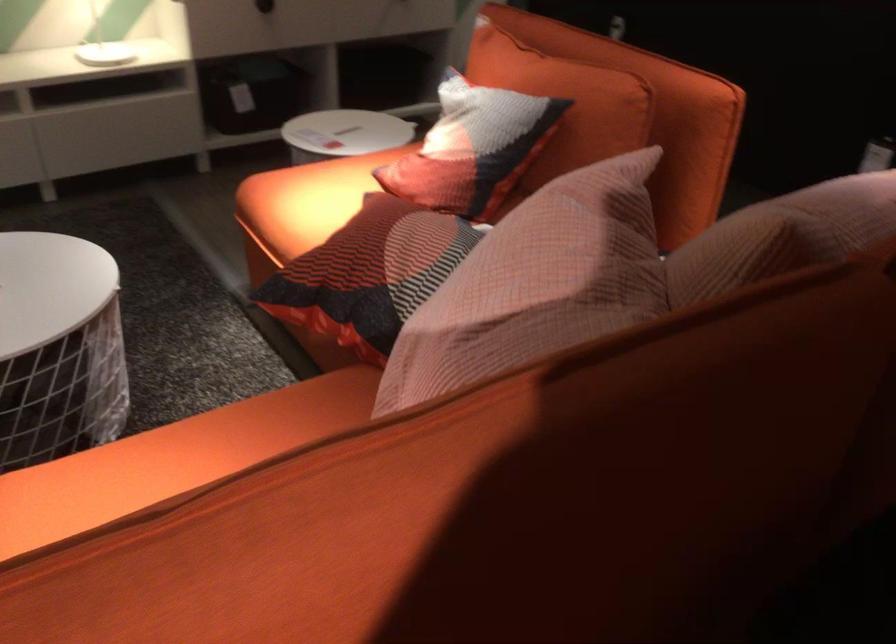
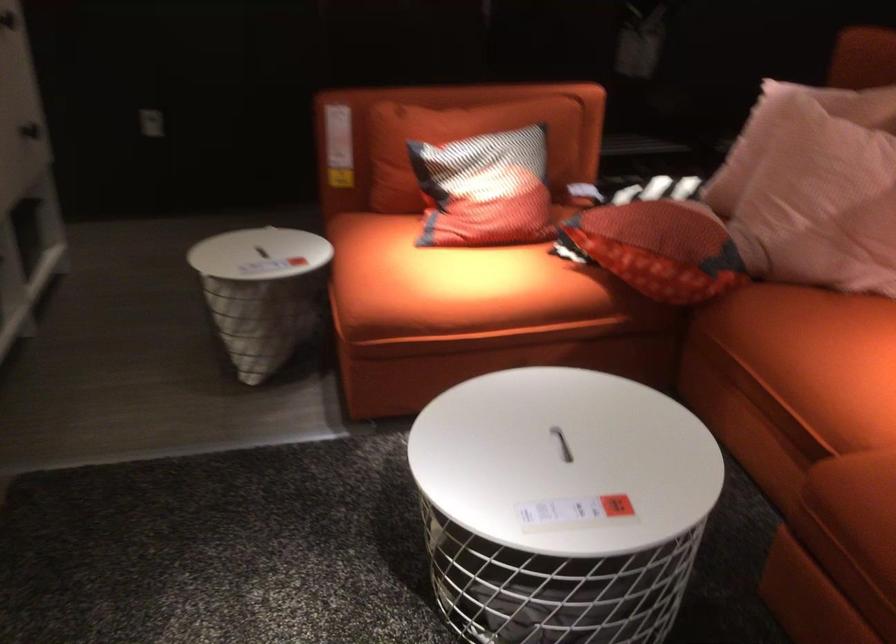
Find the pixel in the second image that matches point (440, 146) in the first image.

(485, 190)